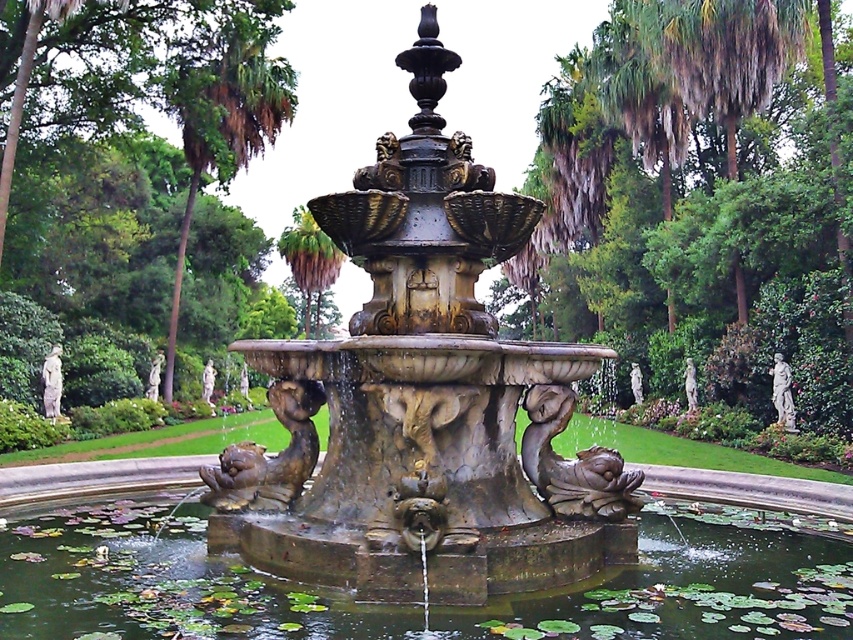
Question: Which of these objects is positioned closest to the green leafy palm tree at center?

Choices:
 (A) bronze fountain at center
 (B) green mossy water at center
 (C) green leafy palm tree at upper center

Answer: (C)

Question: Is green leafy palm tree at upper center to the right of green leafy palm tree at center from the viewer's perspective?

Choices:
 (A) yes
 (B) no

Answer: (A)

Question: Which point appears closest to the camera in this image?

Choices:
 (A) (646, 582)
 (B) (315, 324)

Answer: (A)

Question: Does green leafy palm tree at upper center appear over green leafy palm tree at center?

Choices:
 (A) yes
 (B) no

Answer: (B)

Question: Where is green mossy water at center located in relation to green leafy palm tree at upper center in the image?

Choices:
 (A) above
 (B) below

Answer: (B)

Question: Which of these objects is positioned closest to the green mossy water at center?

Choices:
 (A) green leafy palm tree at upper center
 (B) green leafy palm tree at center
 (C) bronze fountain at center

Answer: (C)